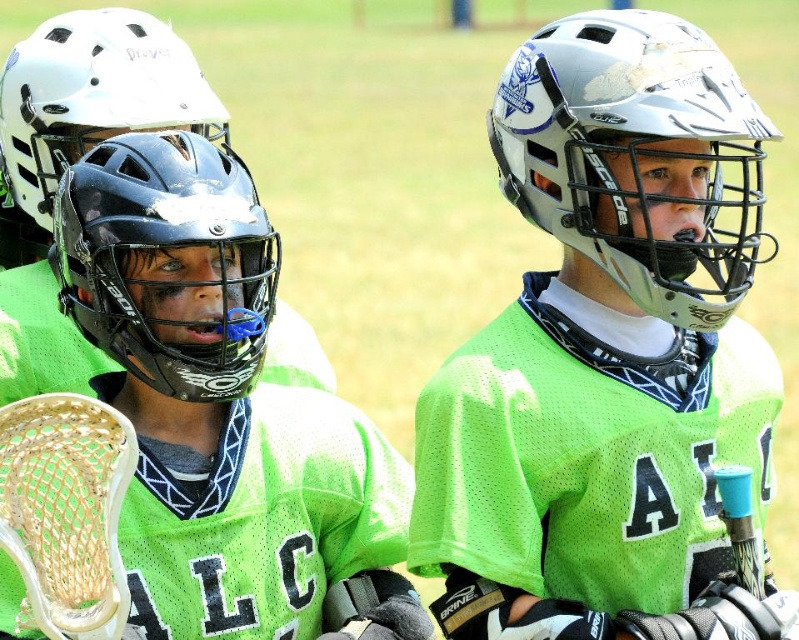
You are a sports analyst trying to determine the positions of players on the field. Given the coordinates provided, where is the white matte helmet at center positioned relative to the other players?

The white matte helmet at center is located at point coordinates (633, 154), which places it centrally among the three players.

Consider the image. You are a sports photographer trying to capture a clear shot of the black matte helmet at center and the white matte helmet at upper left. Which helmet will appear larger in your photo?

The black matte helmet at center will appear larger in the photo because it is closer to the viewer than the white matte helmet at upper left.

You are a lacrosse player standing at the center of the field. You notice two points marked on the field. The first point is at coordinates point (638, 189) and the second is at point (89, 220). If you want to move towards the point that is further away from you, which coordinate should you head towards?

Point (638, 189) is behind point (89, 220), so you should head towards point (638, 189) because it is further away from your current position at the center.